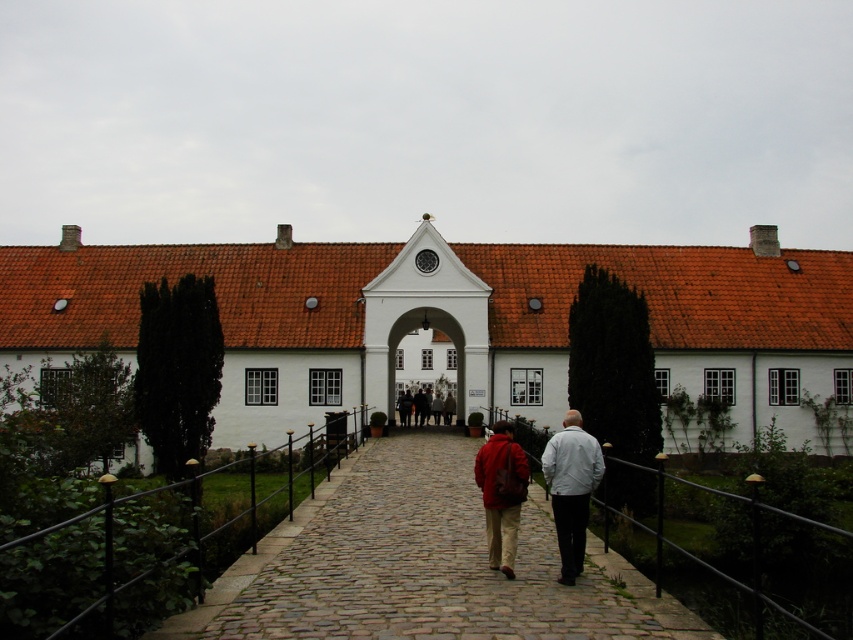
Question: Which object is the closest to the cobblestone path at center?

Choices:
 (A) white matte jacket at center
 (B) white stone archway at center
 (C) matte red jacket at center
 (D) white smooth building at center

Answer: (C)

Question: Can you confirm if cobblestone path at center is positioned below matte red jacket at center?

Choices:
 (A) yes
 (B) no

Answer: (A)

Question: Which of the following is the farthest from the observer?

Choices:
 (A) dark red leather jacket at center
 (B) matte red jacket at center
 (C) white smooth building at center
 (D) cobblestone path at center

Answer: (A)

Question: Can you confirm if white matte jacket at center is thinner than dark red leather jacket at center?

Choices:
 (A) no
 (B) yes

Answer: (B)

Question: Is white smooth building at center thinner than white matte jacket at center?

Choices:
 (A) yes
 (B) no

Answer: (B)

Question: Which object appears farthest from the camera in this image?

Choices:
 (A) matte red jacket at center
 (B) white smooth building at center
 (C) cobblestone path at center
 (D) white stone archway at center

Answer: (D)